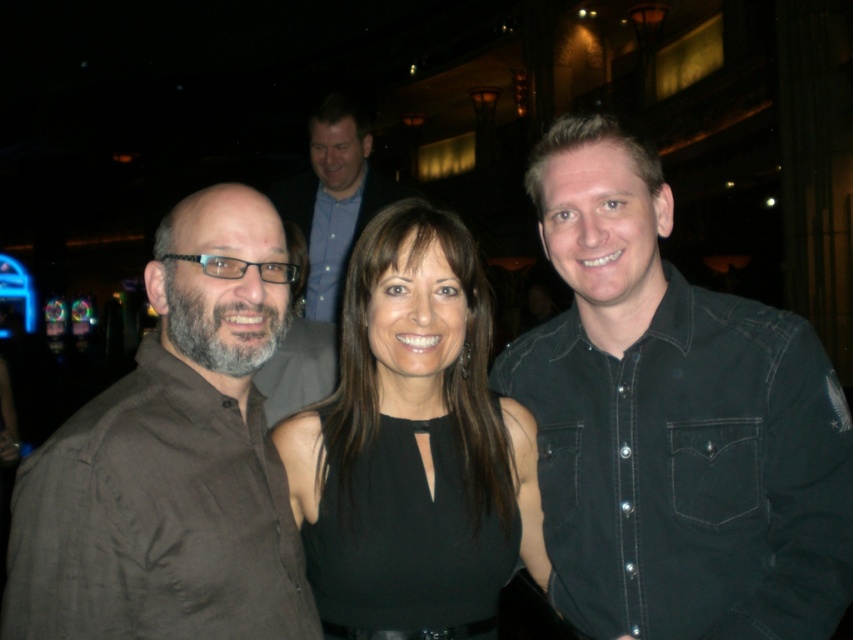
Question: Which of the following is the farthest from the observer?

Choices:
 (A) [x=184, y=336]
 (B) [x=590, y=486]
 (C) [x=354, y=157]

Answer: (C)

Question: Is brownmaterialshirt at left wider than black matte dress at center?

Choices:
 (A) no
 (B) yes

Answer: (A)

Question: Does black denim shirt at center come in front of blue button-down shirt at upper center?

Choices:
 (A) yes
 (B) no

Answer: (A)

Question: Which point is farther to the camera?

Choices:
 (A) (102, 515)
 (B) (366, 134)
 (C) (788, 522)
 (D) (492, 465)

Answer: (B)

Question: Which of these objects is positioned closest to the brownmaterialshirt at left?

Choices:
 (A) black matte dress at center
 (B) blue button-down shirt at upper center

Answer: (A)

Question: Does black matte dress at center have a greater width compared to blue button-down shirt at upper center?

Choices:
 (A) no
 (B) yes

Answer: (A)